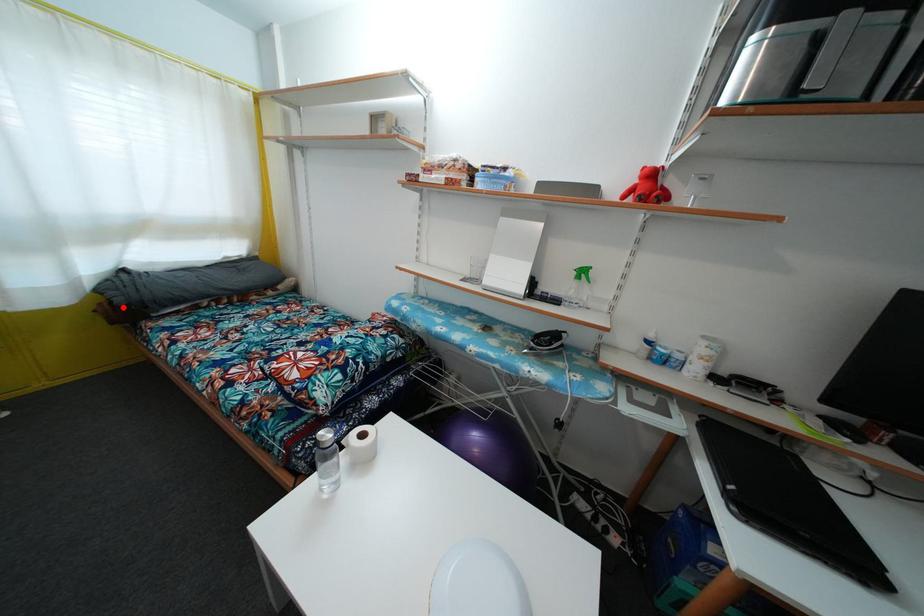
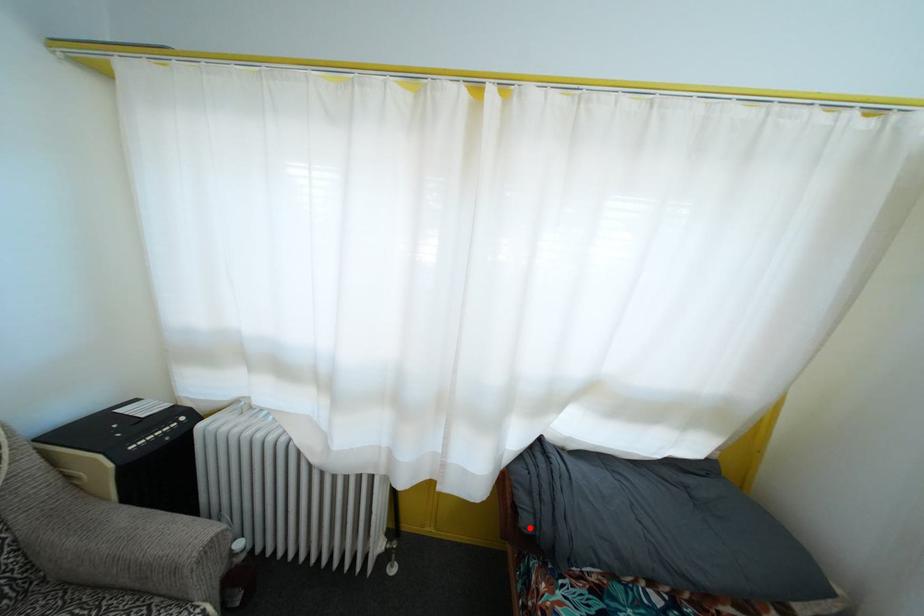
I am providing you with two images of the same scene from different viewpoints. A red point is marked on the first image and another point is marked on the second image. Are the points marked in image1 and image2 representing the same 3D position?

Yes